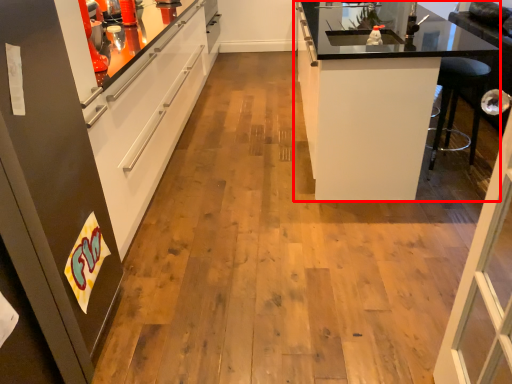
Question: From the image, what is the correct spatial relationship of cabinetry (annotated by the red box) in relation to cabinetry?

Choices:
 (A) left
 (B) right

Answer: (B)